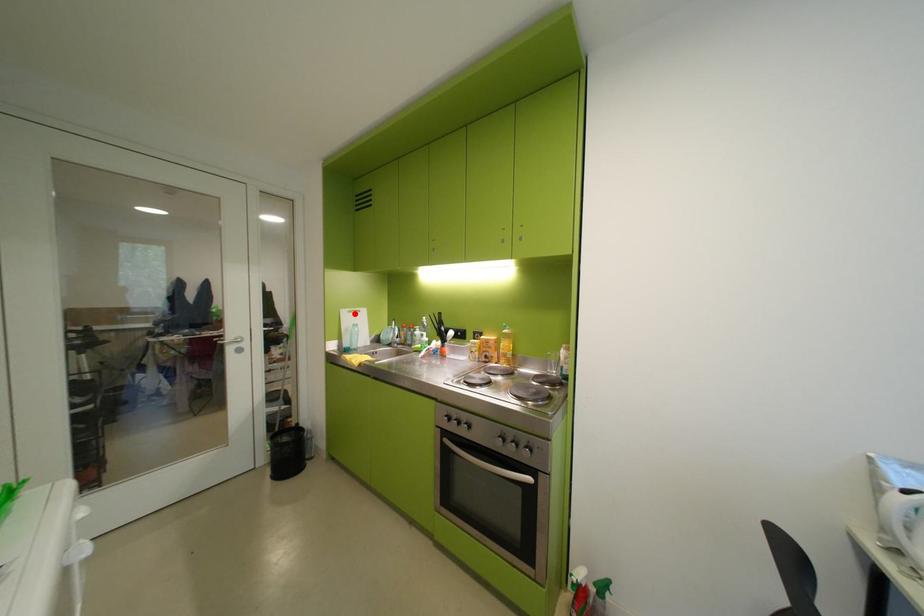
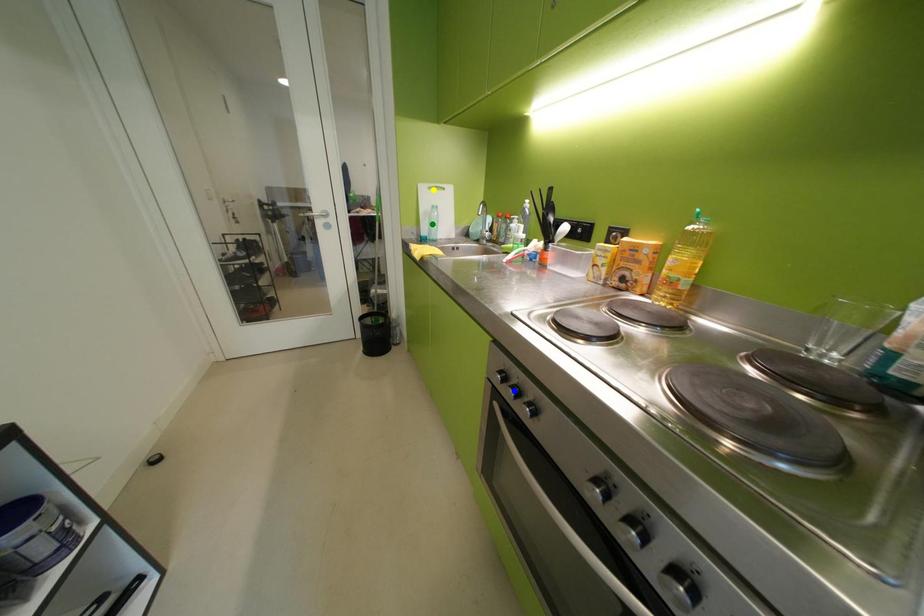
Question: I am providing you with two images of the same scene from different viewpoints. A red point is marked on the first image. You are given multiple points on the second image. Which mark in image 2 goes with the point in image 1?

Choices:
 (A) green point
 (B) blue point
 (C) yellow point

Answer: (C)